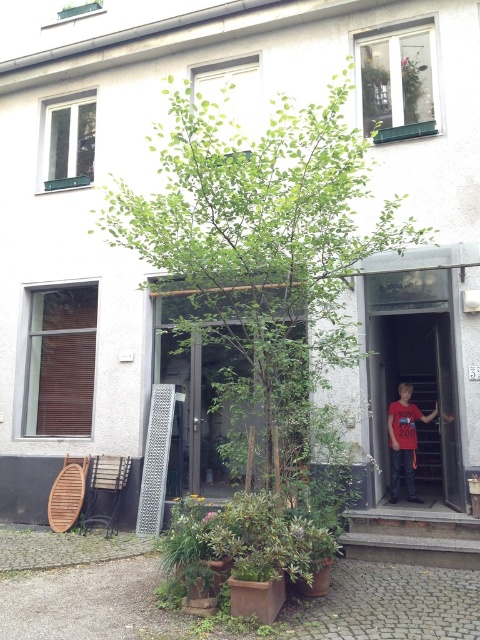
Based on the scene description, where is the green leafy tree at center located in terms of its 2D coordinates?

The green leafy tree at center is located at the 2D coordinates of point (x=260, y=248).